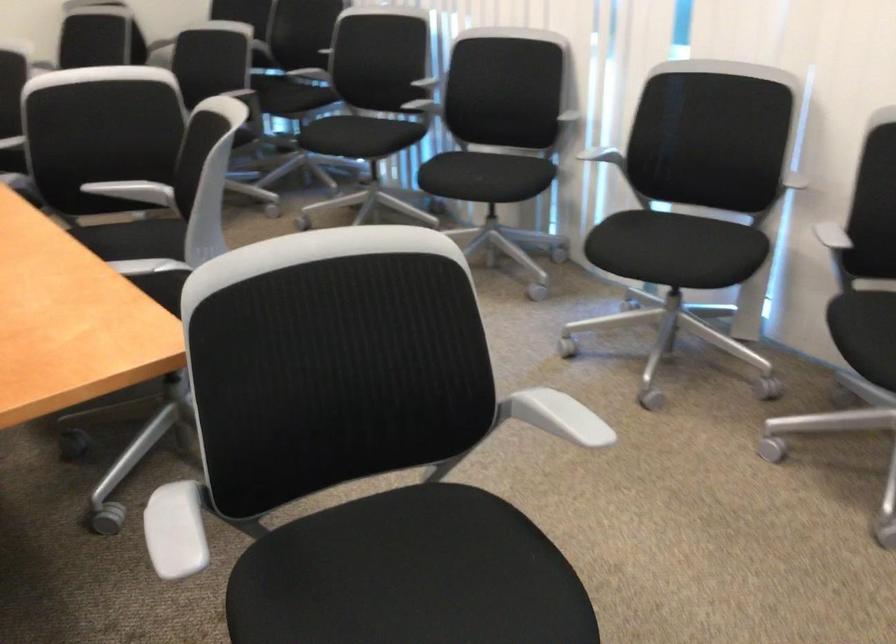
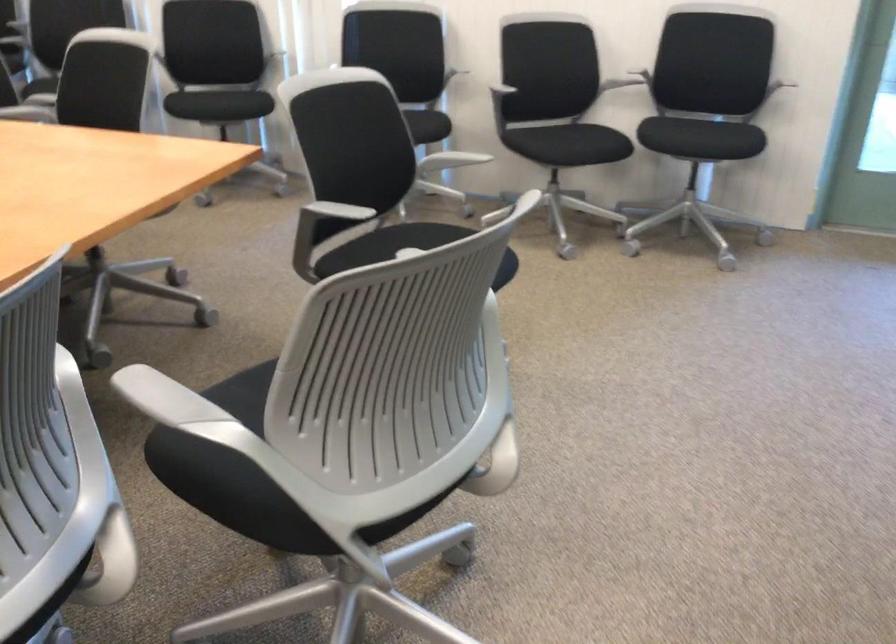
Locate, in the second image, the point that corresponds to pixel 501 187 in the first image.

(238, 102)